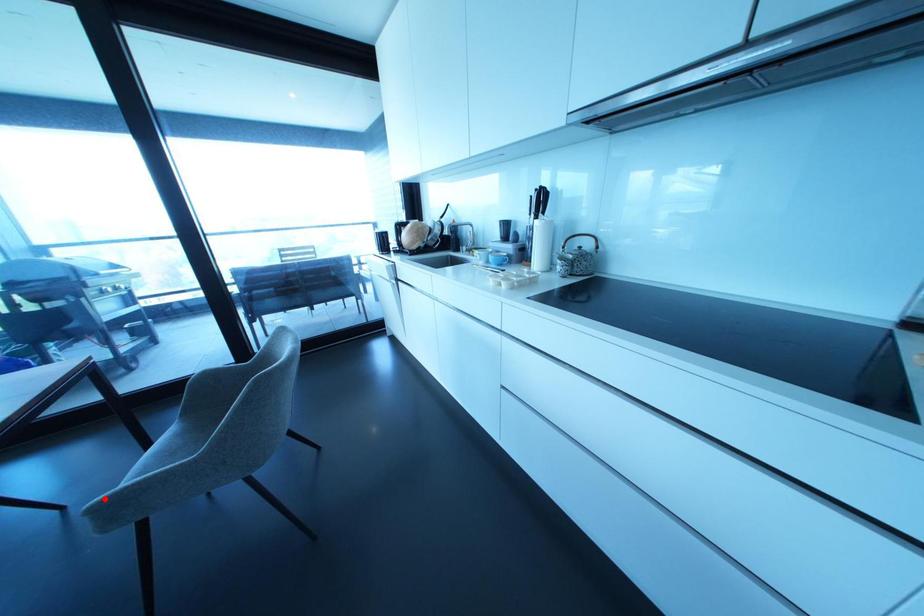
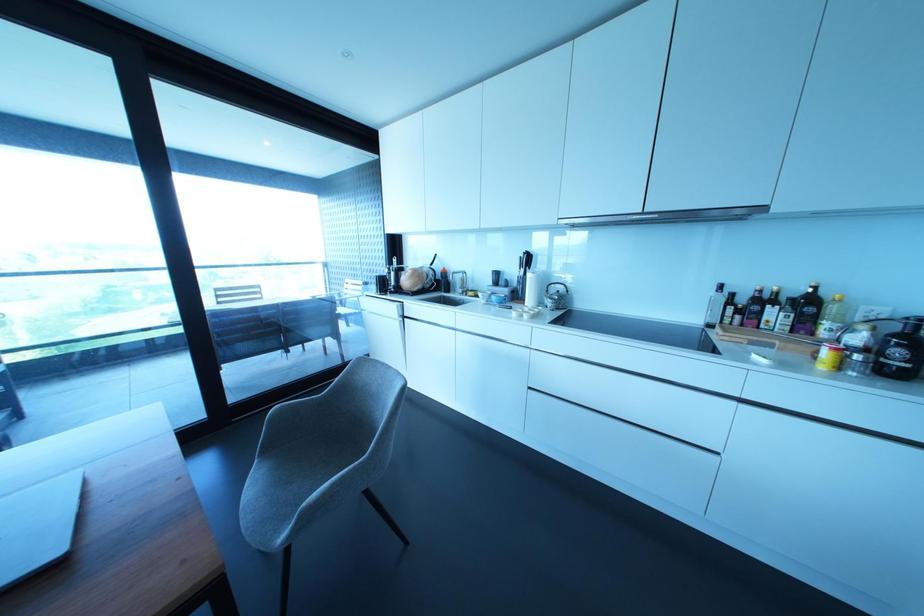
Question: I am providing you with two images of the same scene from different viewpoints. In image1, a red point is highlighted. Considering the same 3D point in image2, which of the following is correct?

Choices:
 (A) It is closer
 (B) It is farther

Answer: (B)